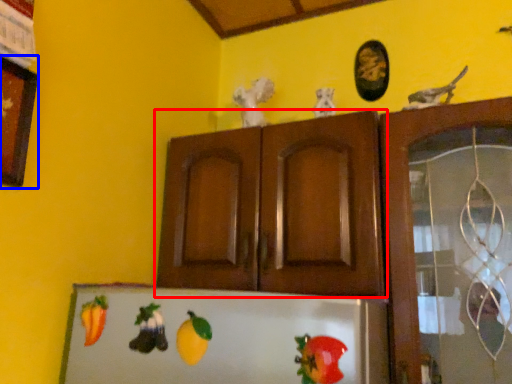
Question: Which object is further to the camera taking this photo, cabinetry (highlighted by a red box) or picture frame (highlighted by a blue box)?

Choices:
 (A) cabinetry
 (B) picture frame

Answer: (A)